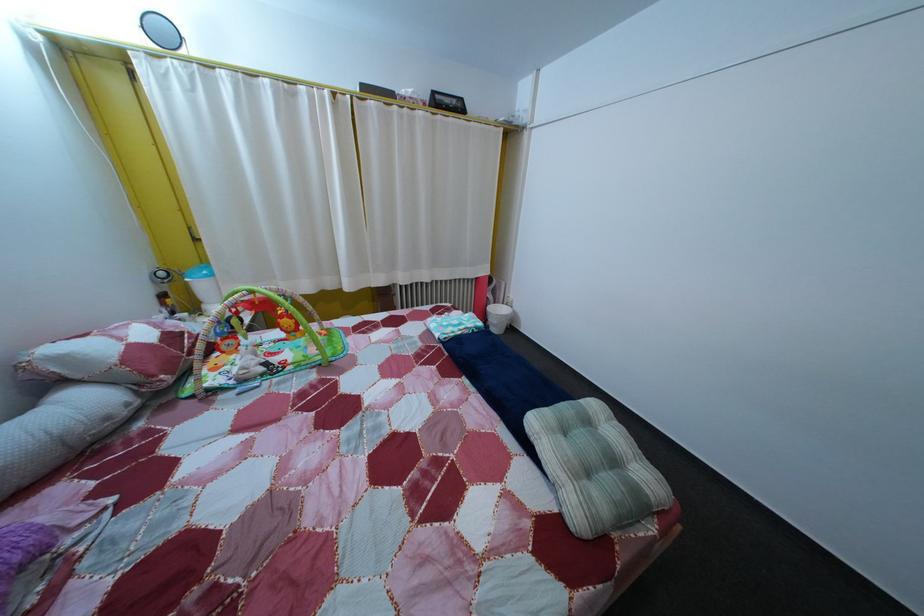
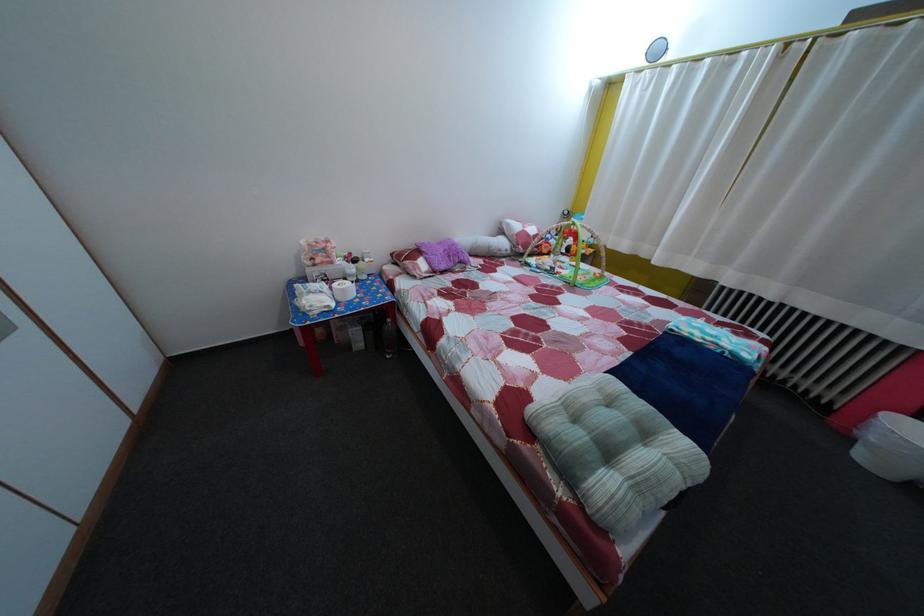
Based on the continuous images, in which direction is the camera rotating?

The rotation direction of the camera is left-down.